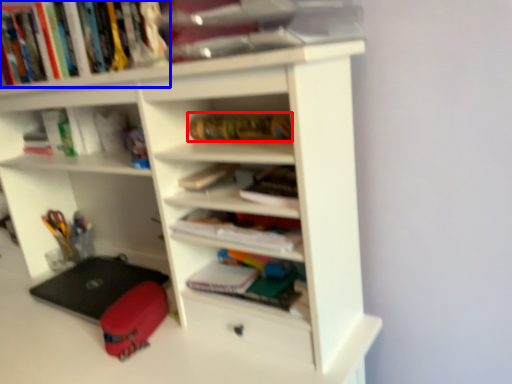
Question: Which of the following is the farthest to the observer, book (highlighted by a red box) or book (highlighted by a blue box)?

Choices:
 (A) book
 (B) book

Answer: (A)